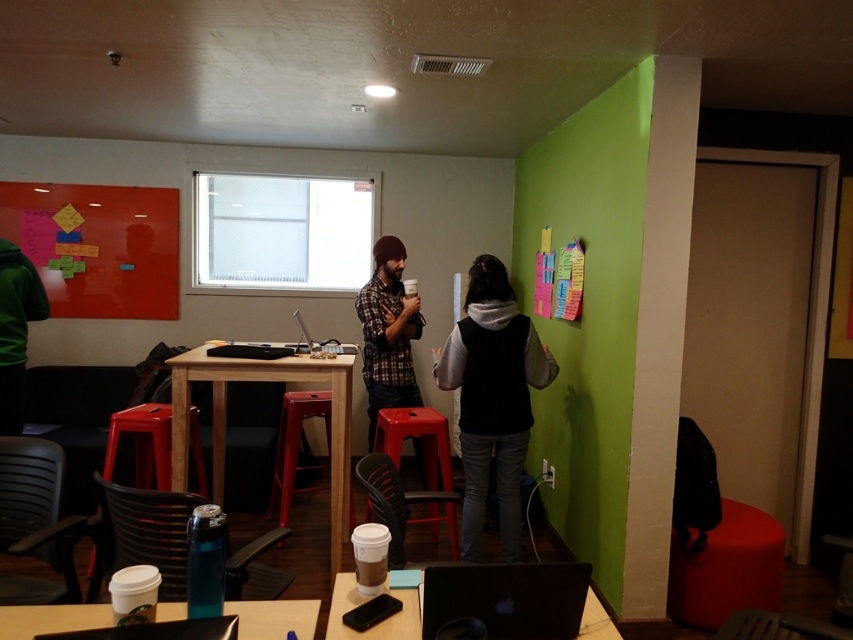
Question: Is black fleece vest at center wider than plaid flannel shirt at center?

Choices:
 (A) yes
 (B) no

Answer: (A)

Question: Based on their relative distances, which object is farther from the plaid flannel shirt at center?

Choices:
 (A) black fleece vest at center
 (B) wooden table at lower center

Answer: (B)

Question: Which object is the closest to the wooden table at lower center?

Choices:
 (A) green matte jacket at left
 (B) light brown wooden table at center

Answer: (B)

Question: Among these points, which one is nearest to the camera?

Choices:
 (A) (166, 488)
 (B) (550, 596)
 (C) (170, 360)

Answer: (B)

Question: Is black glossy laptop at lower center further to the viewer compared to wooden table at lower center?

Choices:
 (A) yes
 (B) no

Answer: (A)

Question: Is plaid flannel shirt at center above matte plastic stool at center?

Choices:
 (A) no
 (B) yes

Answer: (B)